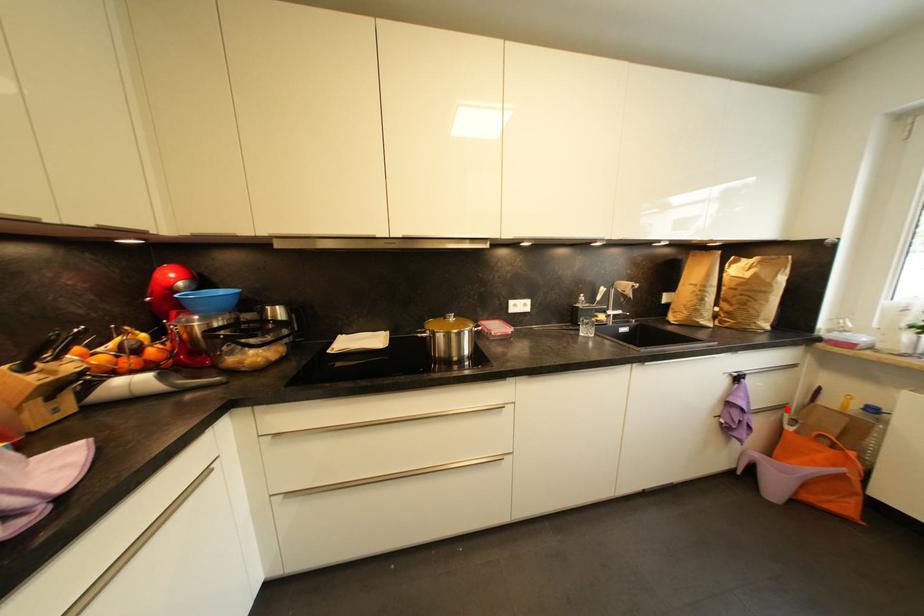
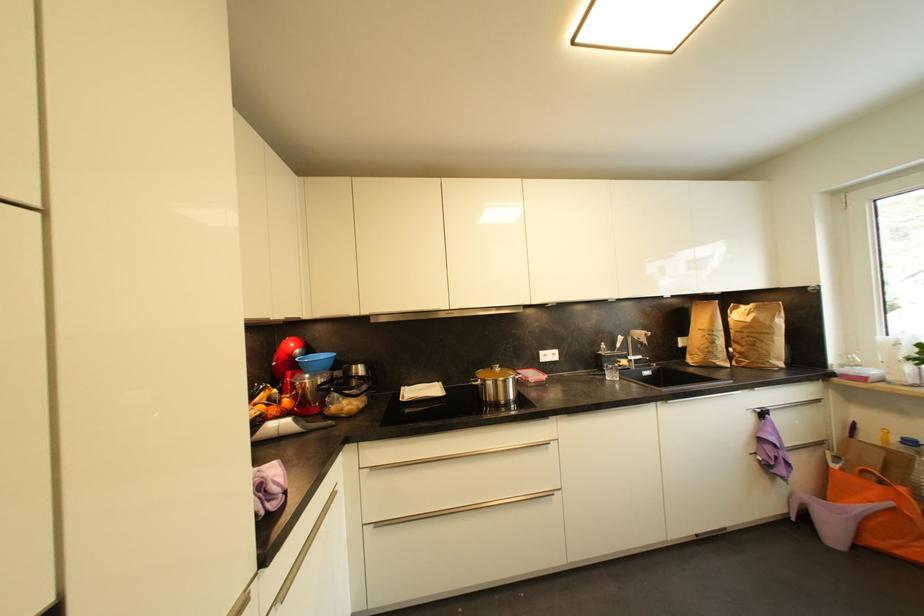
Question: I am providing you with two images of the same scene from different viewpoints. Image1 has a red point marked. In image2, the corresponding 3D location appears at what relative position? Reply with the corresponding letter.

Choices:
 (A) Closer
 (B) Farther

Answer: (A)